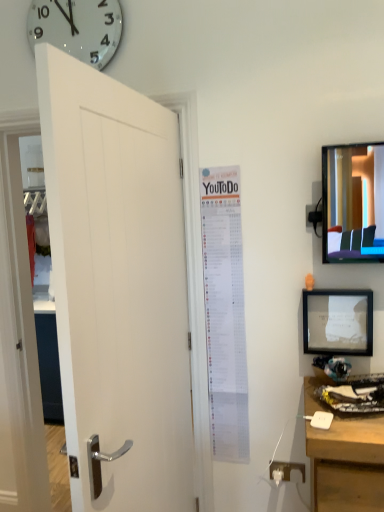
Question: Are white wooden door at left and white plastic outlet at lower right beside each other?

Choices:
 (A) no
 (B) yes

Answer: (A)

Question: Considering the relative sizes of white wooden door at left and white plastic outlet at lower right in the image provided, is white wooden door at left taller than white plastic outlet at lower right?

Choices:
 (A) no
 (B) yes

Answer: (B)

Question: Does white wooden door at left have a smaller size compared to white plastic outlet at lower right?

Choices:
 (A) no
 (B) yes

Answer: (A)

Question: Considering the relative sizes of white wooden door at left and white plastic outlet at lower right in the image provided, is white wooden door at left wider than white plastic outlet at lower right?

Choices:
 (A) no
 (B) yes

Answer: (B)

Question: Does white wooden door at left appear on the left side of white plastic outlet at lower right?

Choices:
 (A) yes
 (B) no

Answer: (A)

Question: From the image's perspective, is white paper poster at center above or below white glossy clock at upper left?

Choices:
 (A) above
 (B) below

Answer: (B)

Question: In terms of width, does white paper poster at center look wider or thinner when compared to white glossy clock at upper left?

Choices:
 (A) wide
 (B) thin

Answer: (B)

Question: Relative to white glossy clock at upper left, is white paper poster at center in front or behind?

Choices:
 (A) behind
 (B) front

Answer: (A)

Question: Is point (218, 300) closer or farther from the camera than point (46, 31)?

Choices:
 (A) closer
 (B) farther

Answer: (A)

Question: Visually, is white wooden door at left positioned to the left or to the right of white glossy clock at upper left?

Choices:
 (A) right
 (B) left

Answer: (A)

Question: Choose the correct answer: Is white wooden door at left inside white glossy clock at upper left or outside it?

Choices:
 (A) inside
 (B) outside

Answer: (B)

Question: Is white wooden door at left wider or thinner than white glossy clock at upper left?

Choices:
 (A) thin
 (B) wide

Answer: (B)

Question: From a real-world perspective, relative to white glossy clock at upper left, is white wooden door at left vertically above or below?

Choices:
 (A) above
 (B) below

Answer: (B)

Question: Looking at their shapes, would you say white paper poster at center is wider or thinner than white plastic outlet at lower right?

Choices:
 (A) thin
 (B) wide

Answer: (B)

Question: From a real-world perspective, is white paper poster at center above or below white plastic outlet at lower right?

Choices:
 (A) above
 (B) below

Answer: (A)